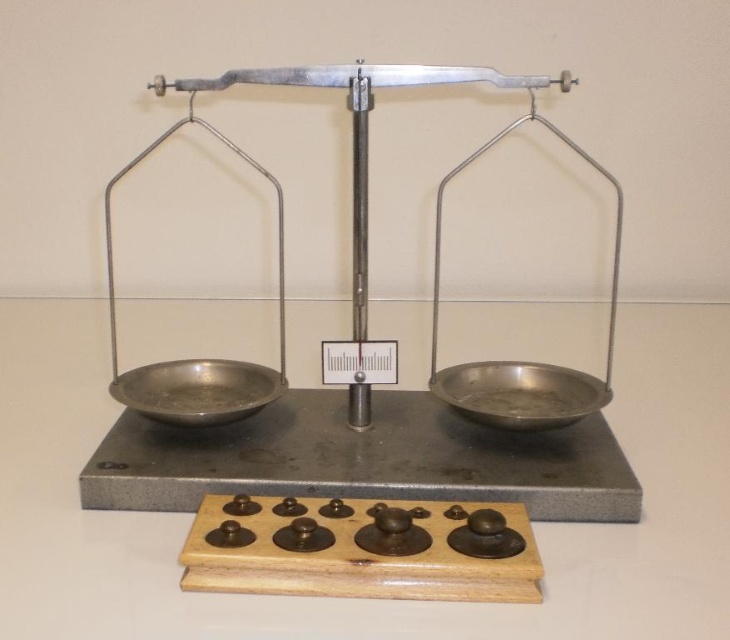
You are a customer in a store and want to place a metallic silver bowl at right onto the balance scale. Based on the scene, where exactly should you place it?

The metallic silver bowl at right should be placed on one of the pans of the balance scale since the pans are designed to hold items for weighing.

You have a small toy car that is 12 centimeters long. You want to place it on either the wooden tray at center or the metallic silver bowl at right. Based on their widths, which one can definitely fit the toy car without overhanging?

The wooden tray at center is wider than the metallic silver bowl at right, so the toy car will fit better on the wooden tray at center.

You are standing in front of the image and want to locate the metallic scale at center. What are the coordinates of its position?

The metallic scale at center is located at coordinates point (x=395, y=438).